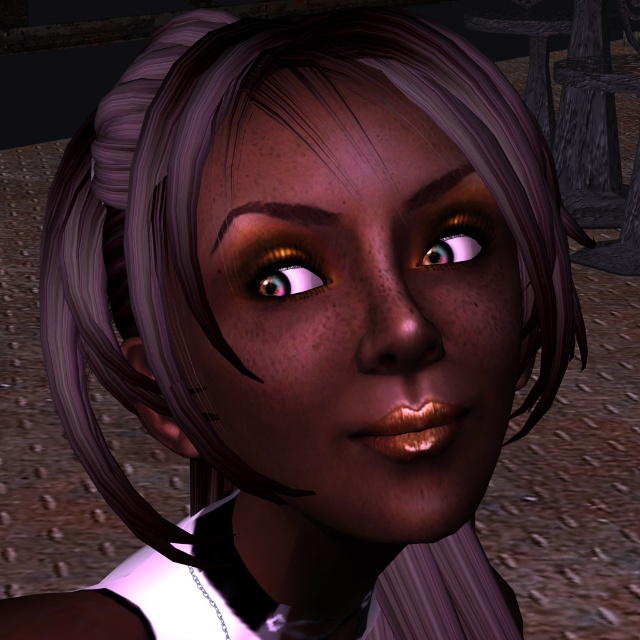
Question: Where is shiny brown eyebrow at upper center located in relation to brown matte eyebrow at upper center in the image?

Choices:
 (A) left
 (B) right

Answer: (A)

Question: Estimate the real-world distances between objects in this image. Which object is closer to the shiny brown eyebrow at upper center?

Choices:
 (A) matte skin face at center
 (B) shiny gold eye at center
 (C) shiny brown eye at upper right

Answer: (B)

Question: Does shiny gold eye at center have a smaller size compared to shiny brown eyebrow at upper center?

Choices:
 (A) no
 (B) yes

Answer: (B)

Question: Which of the following is the farthest from the observer?

Choices:
 (A) (276, 292)
 (B) (420, 189)

Answer: (B)

Question: Does matte skin face at center have a smaller size compared to brown matte eyebrow at upper center?

Choices:
 (A) no
 (B) yes

Answer: (A)

Question: Which of the following is the closest to the observer?

Choices:
 (A) shiny gold eye at center
 (B) matte skin face at center
 (C) shiny brown eye at upper right

Answer: (B)